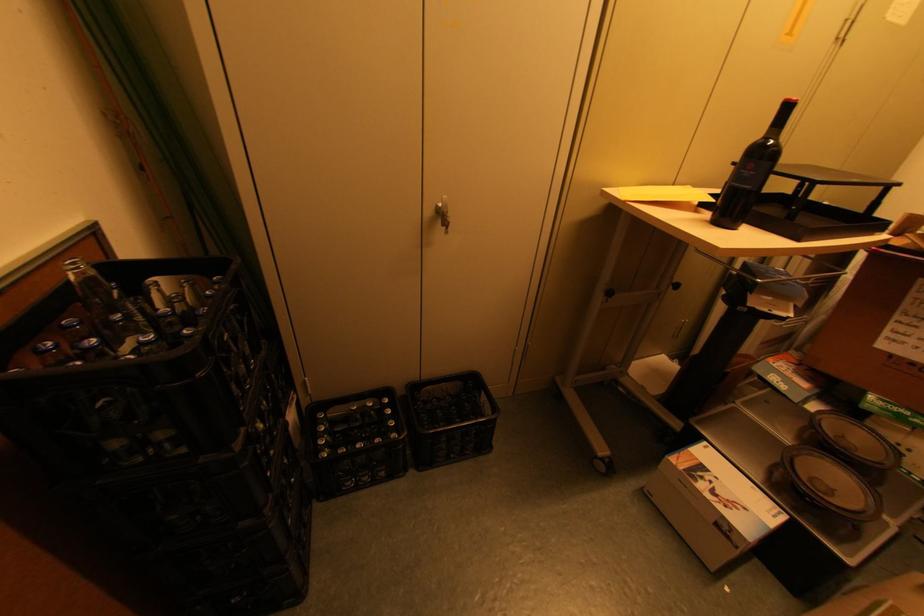
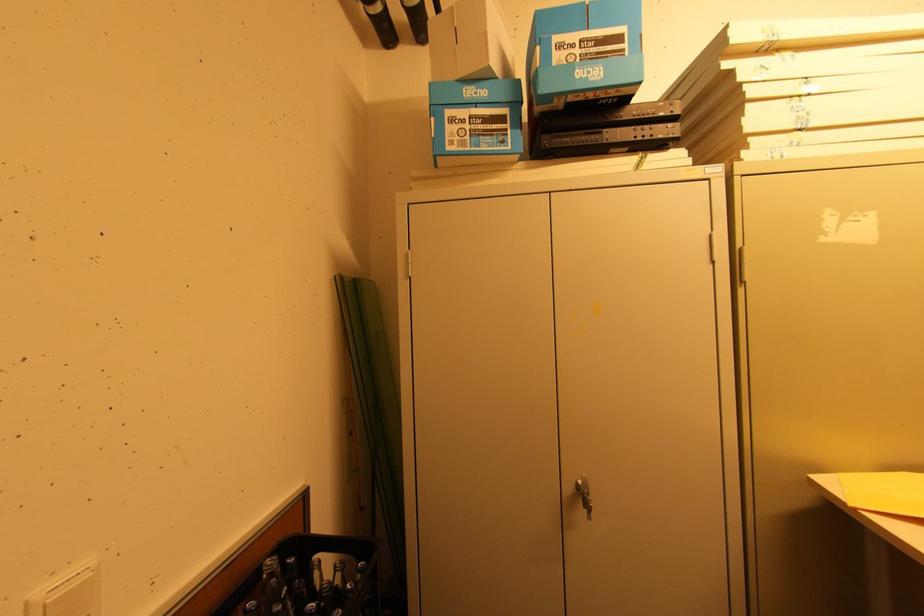
The point at (x=78, y=278) is marked in the first image. Where is the corresponding point in the second image?

(268, 578)